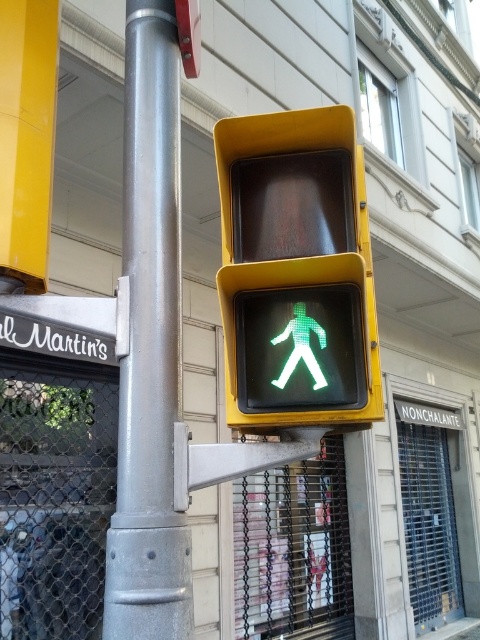
Is point (319, 356) farther from viewer compared to point (142, 476)?

Yes, it is behind point (142, 476).

Can you confirm if matte yellow pedestrian signal at center is positioned below silver metallic pole at center?

No, matte yellow pedestrian signal at center is not below silver metallic pole at center.

Who is more distant from viewer, (x=298, y=214) or (x=144, y=310)?

The point (x=298, y=214) is more distant.

The width and height of the screenshot is (480, 640). In order to click on matte yellow pedestrian signal at center in this screenshot , I will do `click(296, 272)`.